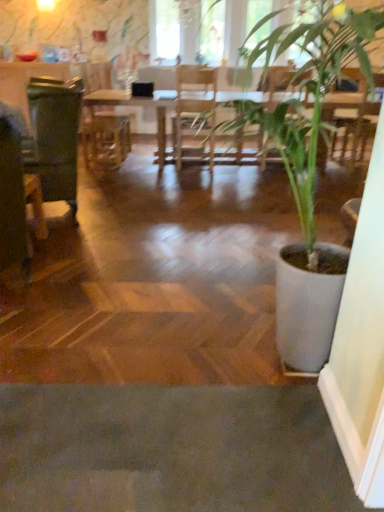
Question: From the image's perspective, is wooden armchair at center below green leafy plant at center?

Choices:
 (A) yes
 (B) no

Answer: (B)

Question: From a real-world perspective, is wooden armchair at center positioned over green leafy plant at center based on gravity?

Choices:
 (A) yes
 (B) no

Answer: (B)

Question: Is wooden armchair at center not inside green leafy plant at center?

Choices:
 (A) yes
 (B) no

Answer: (A)

Question: Is wooden armchair at center facing towards green leafy plant at center?

Choices:
 (A) no
 (B) yes

Answer: (A)

Question: Is wooden armchair at center thinner than green leafy plant at center?

Choices:
 (A) yes
 (B) no

Answer: (A)

Question: In terms of size, does wooden armchair at center appear bigger or smaller than transparent glass window screen at upper center, the 1th window screen positioned from the left?

Choices:
 (A) big
 (B) small

Answer: (A)

Question: Is point coord(94,133) positioned closer to the camera than point coord(158,57)?

Choices:
 (A) closer
 (B) farther

Answer: (B)

Question: From a real-world perspective, is wooden armchair at center above or below transparent glass window screen at upper center, the 1th window screen positioned from the left?

Choices:
 (A) above
 (B) below

Answer: (B)

Question: Would you say wooden armchair at center is to the left or to the right of transparent glass window screen at upper center, the 1th window screen positioned from the left, in the picture?

Choices:
 (A) right
 (B) left

Answer: (B)

Question: From a real-world perspective, is transparent glass window screen at upper center, the 1th window screen viewed from the right, above or below transparent glass window screen at upper center, the 1th window screen positioned from the left?

Choices:
 (A) above
 (B) below

Answer: (A)

Question: Relative to transparent glass window screen at upper center, the 1th window screen positioned from the left, is transparent glass window screen at upper center, the second window screen when ordered from left to right, in front or behind?

Choices:
 (A) behind
 (B) front

Answer: (B)

Question: Is transparent glass window screen at upper center, the second window screen when ordered from left to right, bigger or smaller than transparent glass window screen at upper center, marked as the 2th window screen in a right-to-left arrangement?

Choices:
 (A) big
 (B) small

Answer: (A)

Question: Looking at their shapes, would you say transparent glass window screen at upper center, the 1th window screen viewed from the right, is wider or thinner than transparent glass window screen at upper center, marked as the 2th window screen in a right-to-left arrangement?

Choices:
 (A) thin
 (B) wide

Answer: (B)

Question: Would you say green matte swivel chair at left is inside or outside wooden armchair at center?

Choices:
 (A) inside
 (B) outside

Answer: (B)

Question: Considering their positions, is green matte swivel chair at left located in front of or behind wooden armchair at center?

Choices:
 (A) behind
 (B) front

Answer: (B)